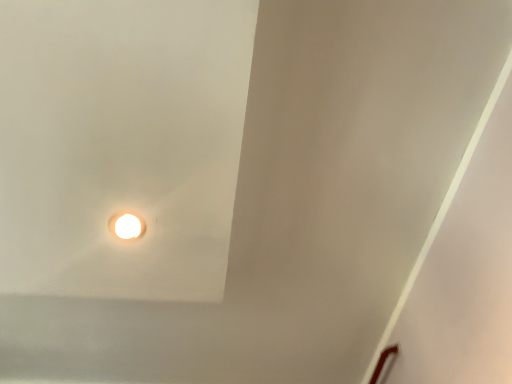
At what (x,y) coordinates should I click in order to perform the action: click on white glossy droplight at upper center. Please return your answer as a coordinate pair (x, y). This screenshot has height=384, width=512. Looking at the image, I should click on (127, 226).

What do you see at coordinates (127, 226) in the screenshot? I see `white glossy droplight at upper center` at bounding box center [127, 226].

Where is `white glossy droplight at upper center`? white glossy droplight at upper center is located at coordinates (127, 226).